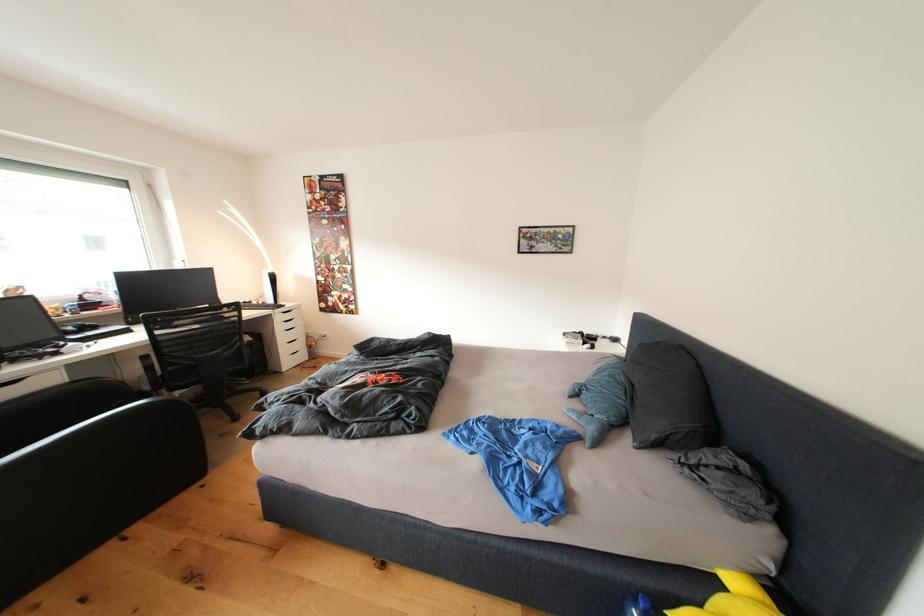
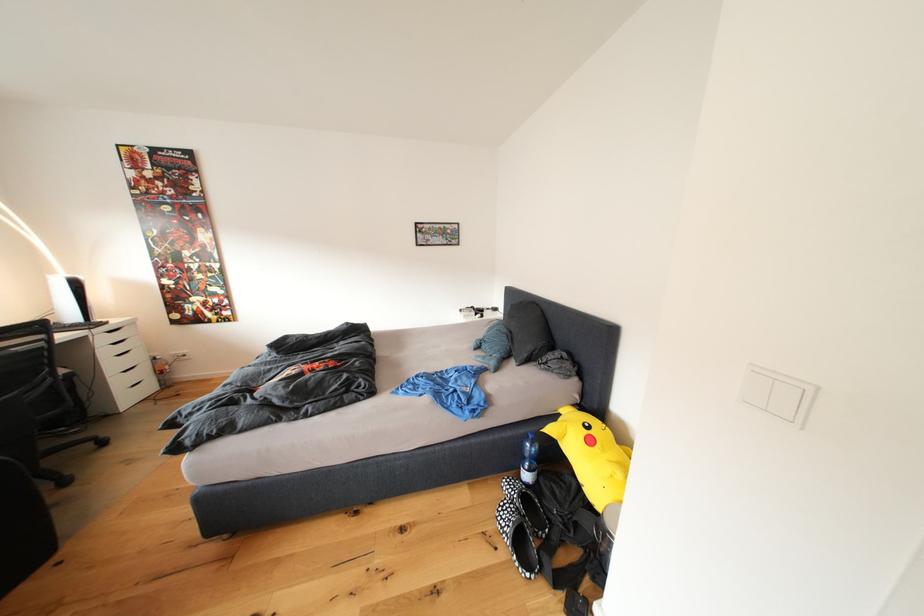
Locate, in the second image, the point that corresponds to point (298, 310) in the first image.

(125, 326)